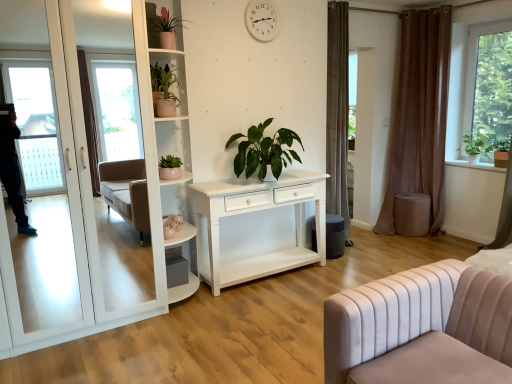
Question: Which direction should I rotate to face green matte plant at center, the 3th houseplant in the right-to-left sequence, — up or down?

Choices:
 (A) down
 (B) up

Answer: (B)

Question: Is brown velvet curtain at right wider than matte pink pot at upper left, which is the 3th houseplant in left-to-right order?

Choices:
 (A) yes
 (B) no

Answer: (A)

Question: Does brown velvet curtain at right have a lesser width compared to matte pink pot at upper left, which is the 3th houseplant in left-to-right order?

Choices:
 (A) no
 (B) yes

Answer: (A)

Question: Considering the relative positions of brown velvet curtain at right and matte pink pot at upper left, placed as the second houseplant when sorted from right to left, in the image provided, is brown velvet curtain at right in front of matte pink pot at upper left, placed as the second houseplant when sorted from right to left,?

Choices:
 (A) yes
 (B) no

Answer: (B)

Question: From a real-world perspective, is brown velvet curtain at right over matte pink pot at upper left, placed as the second houseplant when sorted from right to left?

Choices:
 (A) yes
 (B) no

Answer: (B)

Question: Is brown velvet curtain at right in contact with matte pink pot at upper left, placed as the second houseplant when sorted from right to left?

Choices:
 (A) no
 (B) yes

Answer: (A)

Question: Is brown velvet curtain at right facing towards matte pink pot at upper left, which is the 3th houseplant in left-to-right order?

Choices:
 (A) yes
 (B) no

Answer: (B)

Question: Is green matte plant at center, which is the fourth houseplant from left to right, taller than matte pink pot at upper left, which is the 3th houseplant in left-to-right order?

Choices:
 (A) yes
 (B) no

Answer: (A)

Question: Is green matte plant at center, which is the fourth houseplant from left to right, surrounding matte pink pot at upper left, which is the 3th houseplant in left-to-right order?

Choices:
 (A) yes
 (B) no

Answer: (B)

Question: Is green matte plant at center, the 1th houseplant viewed from the right, smaller than matte pink pot at upper left, placed as the second houseplant when sorted from right to left?

Choices:
 (A) yes
 (B) no

Answer: (B)

Question: Does green matte plant at center, which is the fourth houseplant from left to right, appear on the right side of matte pink pot at upper left, which is the 3th houseplant in left-to-right order?

Choices:
 (A) yes
 (B) no

Answer: (A)

Question: Considering the relative sizes of green matte plant at center, which is the fourth houseplant from left to right, and matte pink pot at upper left, placed as the second houseplant when sorted from right to left, in the image provided, is green matte plant at center, which is the fourth houseplant from left to right, bigger than matte pink pot at upper left, placed as the second houseplant when sorted from right to left,?

Choices:
 (A) no
 (B) yes

Answer: (B)

Question: From a real-world perspective, is green matte plant at center, the 1th houseplant viewed from the right, on matte pink pot at upper left, placed as the second houseplant when sorted from right to left?

Choices:
 (A) yes
 (B) no

Answer: (B)

Question: Is green matte plant at upper left, positioned as the 4th houseplant in right-to-left order, oriented towards brown velvet curtain at right?

Choices:
 (A) no
 (B) yes

Answer: (A)